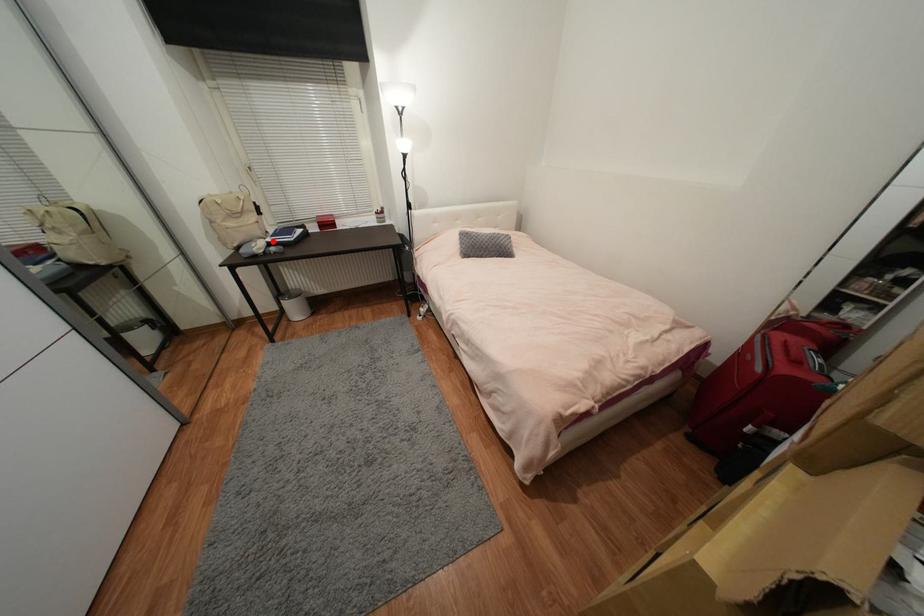
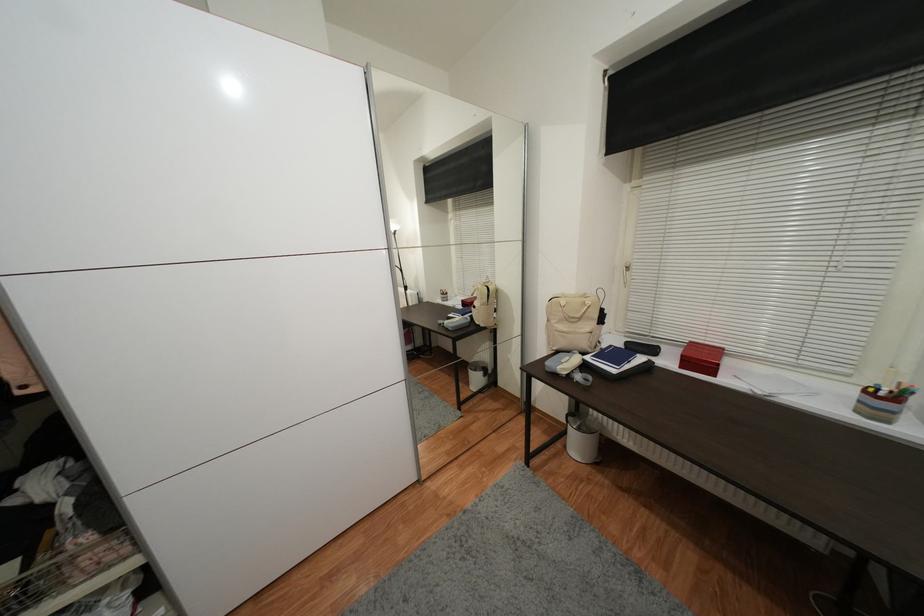
Question: A red point is marked in image1. In image2, is the corresponding 3D point closer to the camera or farther? Reply with the corresponding letter.

Choices:
 (A) The corresponding 3D point is closer.
 (B) The corresponding 3D point is farther.

Answer: (B)